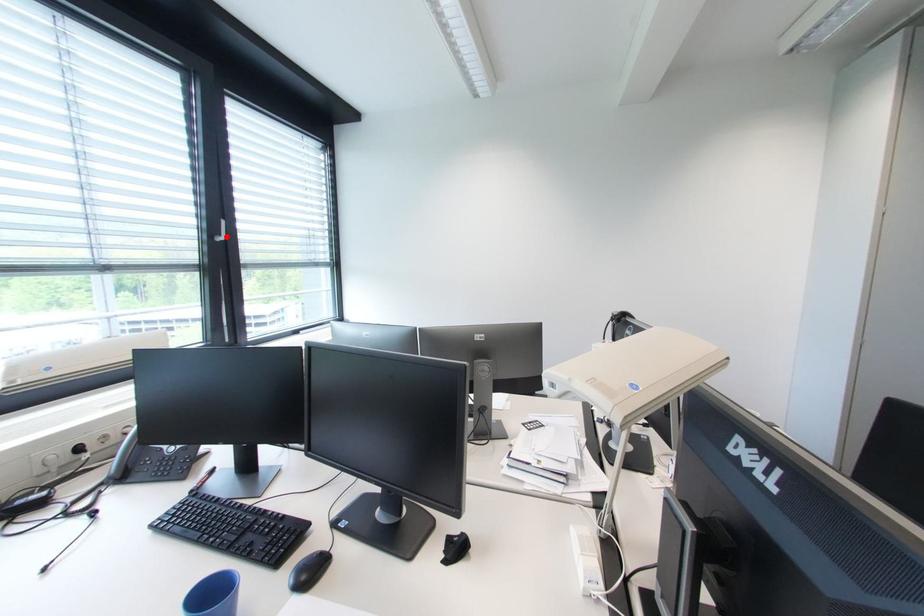
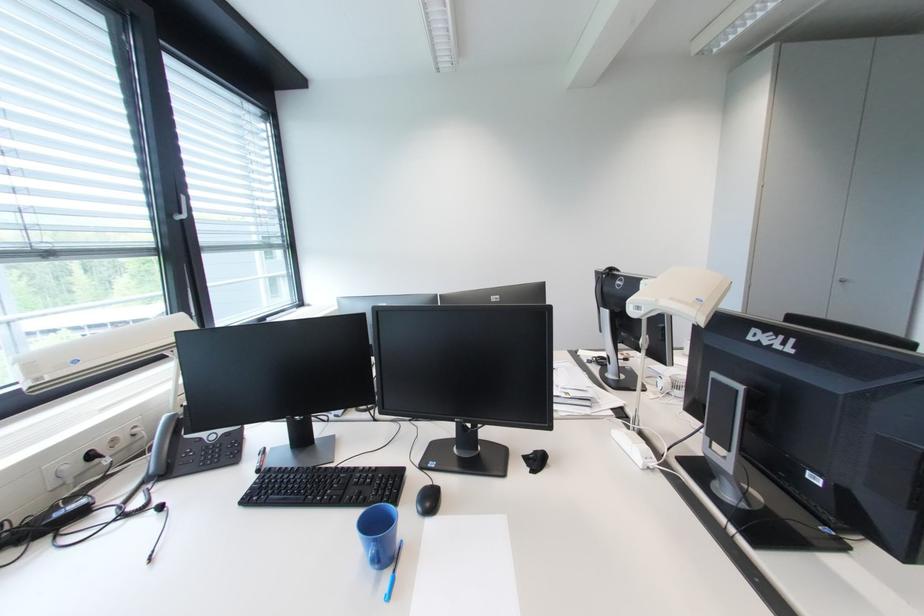
In the second image, find the point that corresponds to the highlighted location in the first image.

(188, 215)